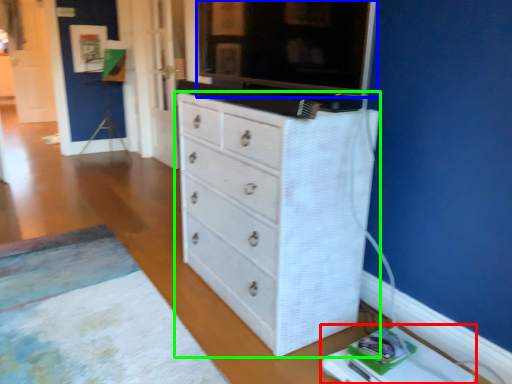
Question: Which object is positioned closest to changing table (highlighted by a red box)? Select from tv cabinet (highlighted by a blue box) and chest of drawers (highlighted by a green box).

Choices:
 (A) tv cabinet
 (B) chest of drawers

Answer: (B)